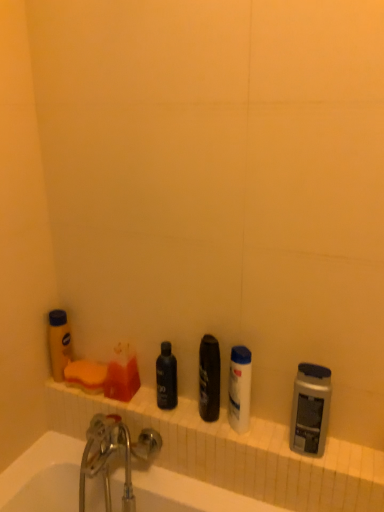
Identify the location of vacant point to the right of white plastic mouthwash at center. This screenshot has width=384, height=512. (x=288, y=442).